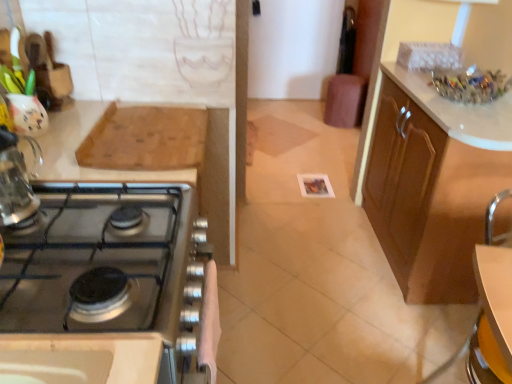
You are a GUI agent. You are given a task and a screenshot of the screen. Output one action in this format:
    pyautogui.click(x=<x>, y=<y>)
    Task: Click on the vacant space situated on the left part of brown wood cabinet at right, positioned as the 2th cabinetry in front-to-back order
    
    Given the screenshot: What is the action you would take?
    pyautogui.click(x=312, y=259)